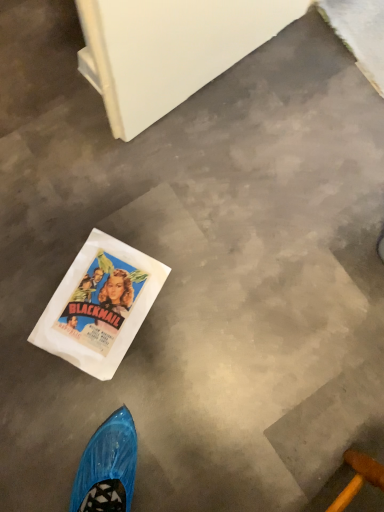
The width and height of the screenshot is (384, 512). I want to click on vacant space behind white paper comic book at lower left, so click(113, 217).